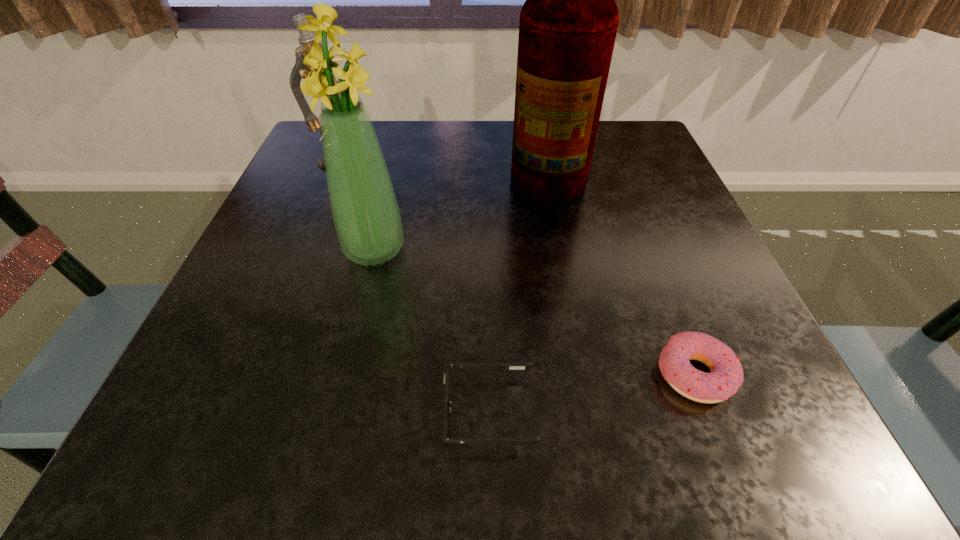
Where is `vacant region between the third tallest object and the sunglasses`? This screenshot has height=540, width=960. vacant region between the third tallest object and the sunglasses is located at coordinates (419, 284).

Identify the location of free point between the third nearest object and the rightmost object. This screenshot has height=540, width=960. (535, 313).

I want to click on free space between the doughnut and the fire extinguisher, so click(619, 272).

Find the location of a particular element. This screenshot has width=960, height=540. free space between the shortest object and the rightmost object is located at coordinates (591, 393).

Locate an element on the screen. This screenshot has height=540, width=960. free point between the second tallest object and the rightmost object is located at coordinates (535, 313).

Locate an element on the screen. The width and height of the screenshot is (960, 540). unoccupied position between the rightmost object and the bouquet is located at coordinates (535, 313).

Where is `unoccupied position between the sunglasses and the bouquet`? The height and width of the screenshot is (540, 960). unoccupied position between the sunglasses and the bouquet is located at coordinates (432, 331).

Find the location of `vacant space that's between the third shortest object and the sunglasses`. vacant space that's between the third shortest object and the sunglasses is located at coordinates (419, 284).

Select which object appears as the closest to the third nearest object. Please provide its 2D coordinates. Your answer should be formatted as a tuple, i.e. [(x, y)], where the tuple contains the x and y coordinates of a point satisfying the conditions above.

[(568, 24)]

Identify which object is located as the second nearest to the microscope. Please provide its 2D coordinates. Your answer should be formatted as a tuple, i.e. [(x, y)], where the tuple contains the x and y coordinates of a point satisfying the conditions above.

[(568, 24)]